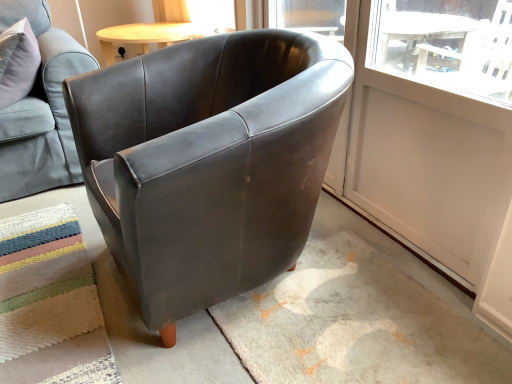
Question: Is matte black armchair at center, arranged as the 2th chair when viewed from the left, outside matte leather armchair at upper left, which ranks as the 2th chair in right-to-left order?

Choices:
 (A) no
 (B) yes

Answer: (B)

Question: Is matte black armchair at center, the 1th chair when ordered from right to left, oriented away from matte leather armchair at upper left, which ranks as the 2th chair in right-to-left order?

Choices:
 (A) yes
 (B) no

Answer: (B)

Question: Considering the relative sizes of matte black armchair at center, arranged as the 2th chair when viewed from the left, and matte leather armchair at upper left, acting as the first chair starting from the left, in the image provided, is matte black armchair at center, arranged as the 2th chair when viewed from the left, shorter than matte leather armchair at upper left, acting as the first chair starting from the left,?

Choices:
 (A) yes
 (B) no

Answer: (B)

Question: Is matte black armchair at center, the 1th chair when ordered from right to left, positioned far away from matte leather armchair at upper left, acting as the first chair starting from the left?

Choices:
 (A) yes
 (B) no

Answer: (B)

Question: Can you confirm if matte black armchair at center, the 1th chair when ordered from right to left, is positioned to the right of matte leather armchair at upper left, which ranks as the 2th chair in right-to-left order?

Choices:
 (A) no
 (B) yes

Answer: (B)

Question: Is point (40, 306) closer or farther from the camera than point (29, 94)?

Choices:
 (A) farther
 (B) closer

Answer: (B)

Question: From a real-world perspective, is multicolored woven mat at lower left physically located above or below matte leather armchair at upper left, which ranks as the 2th chair in right-to-left order?

Choices:
 (A) above
 (B) below

Answer: (B)

Question: Considering the positions of multicolored woven mat at lower left and matte leather armchair at upper left, acting as the first chair starting from the left, in the image, is multicolored woven mat at lower left taller or shorter than matte leather armchair at upper left, acting as the first chair starting from the left,?

Choices:
 (A) short
 (B) tall

Answer: (A)

Question: In the image, is multicolored woven mat at lower left on the left side or the right side of matte leather armchair at upper left, acting as the first chair starting from the left?

Choices:
 (A) left
 (B) right

Answer: (B)

Question: Is white matte screen door at upper right spatially inside matte leather armchair at upper left, which ranks as the 2th chair in right-to-left order, or outside of it?

Choices:
 (A) outside
 (B) inside

Answer: (A)

Question: From a real-world perspective, relative to matte leather armchair at upper left, which ranks as the 2th chair in right-to-left order, is white matte screen door at upper right vertically above or below?

Choices:
 (A) below
 (B) above

Answer: (A)

Question: Considering the positions of point (477, 236) and point (53, 84), is point (477, 236) closer or farther from the camera than point (53, 84)?

Choices:
 (A) closer
 (B) farther

Answer: (A)

Question: Based on their positions, is white matte screen door at upper right located to the left or right of matte leather armchair at upper left, which ranks as the 2th chair in right-to-left order?

Choices:
 (A) right
 (B) left

Answer: (A)

Question: In the image, is matte leather armchair at upper left, acting as the first chair starting from the left, on the left side or the right side of multicolored woven mat at lower left?

Choices:
 (A) right
 (B) left

Answer: (B)

Question: From a real-world perspective, relative to multicolored woven mat at lower left, is matte leather armchair at upper left, which ranks as the 2th chair in right-to-left order, vertically above or below?

Choices:
 (A) below
 (B) above

Answer: (B)